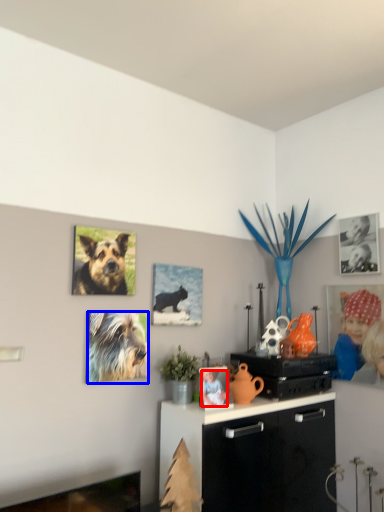
Question: Among these objects, which one is farthest to the camera, person (highlighted by a red box) or dog (highlighted by a blue box)?

Choices:
 (A) person
 (B) dog

Answer: (A)